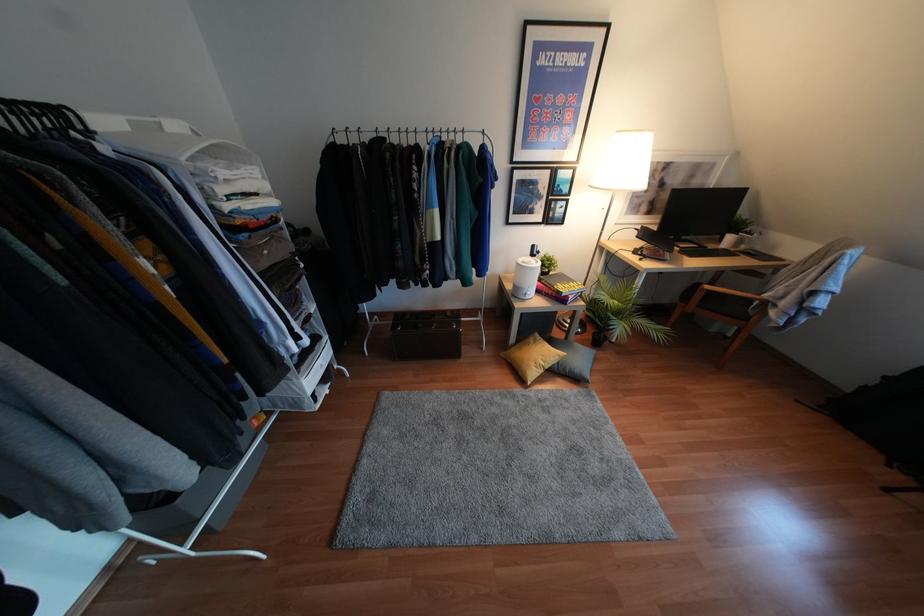
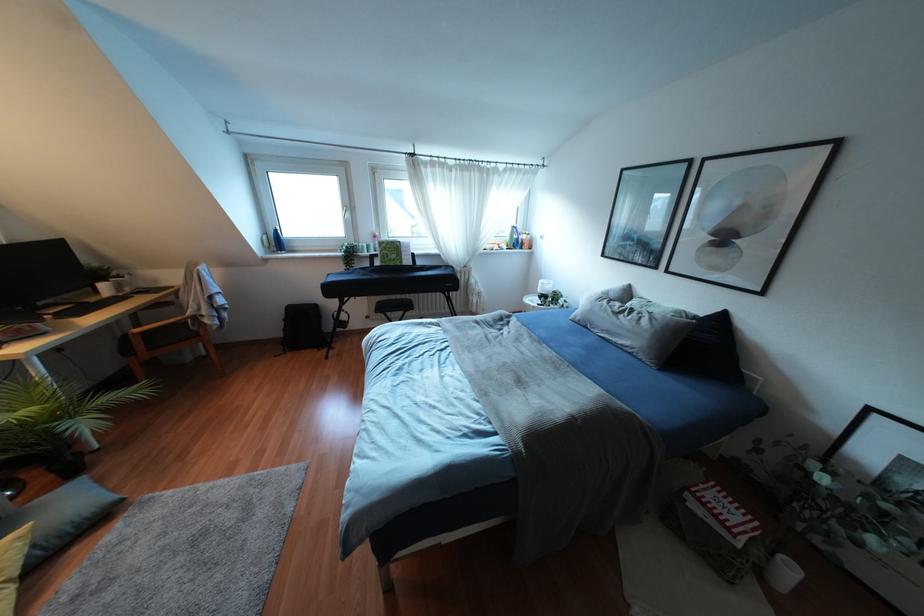
Locate, in the second image, the point that corresponds to point (745, 318) in the first image.

(196, 334)